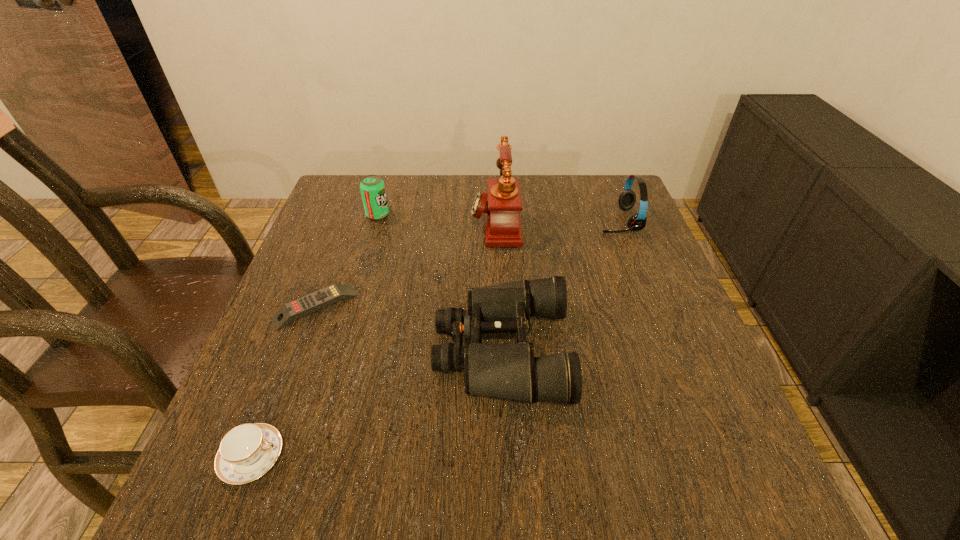
At what (x,y) coordinates should I click in order to perform the action: click on telephone. Please return your answer as a coordinate pair (x, y). This screenshot has width=960, height=540. Looking at the image, I should click on (503, 228).

Identify the location of the rightmost object. (627, 199).

Locate an element on the screen. pop soda is located at coordinates (372, 187).

Identify the location of the third shortest object. The image size is (960, 540). (510, 371).

Find the location of a particular element. The width and height of the screenshot is (960, 540). teacup is located at coordinates (248, 451).

Locate an element on the screen. The image size is (960, 540). the second shortest object is located at coordinates (248, 451).

I want to click on the shortest object, so click(305, 305).

The image size is (960, 540). Identify the location of free space located on the dial of the tallest object. click(333, 222).

Locate an element on the screen. This screenshot has width=960, height=540. free location located 0.150m on the dial of the tallest object is located at coordinates pos(416,222).

Identify the location of free space located on the dial of the tallest object. The image size is (960, 540). (449, 222).